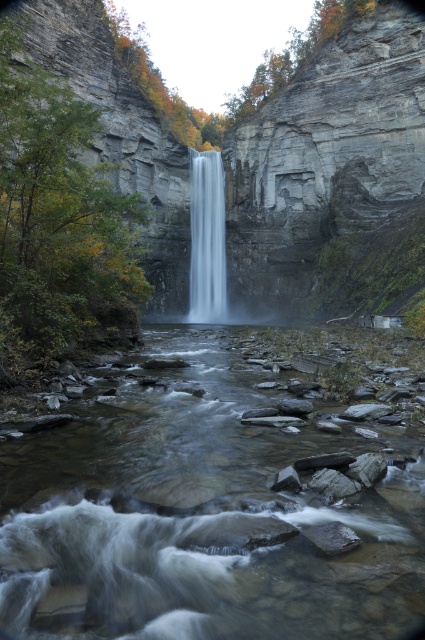
Is clear water at center smaller than white smooth waterfall at center?

Yes, clear water at center is smaller than white smooth waterfall at center.

I want to click on clear water at center, so click(x=206, y=508).

At what (x,y) coordinates should I click in order to perform the action: click on clear water at center. Please return your answer as a coordinate pair (x, y). The width and height of the screenshot is (425, 640). Looking at the image, I should click on (206, 508).